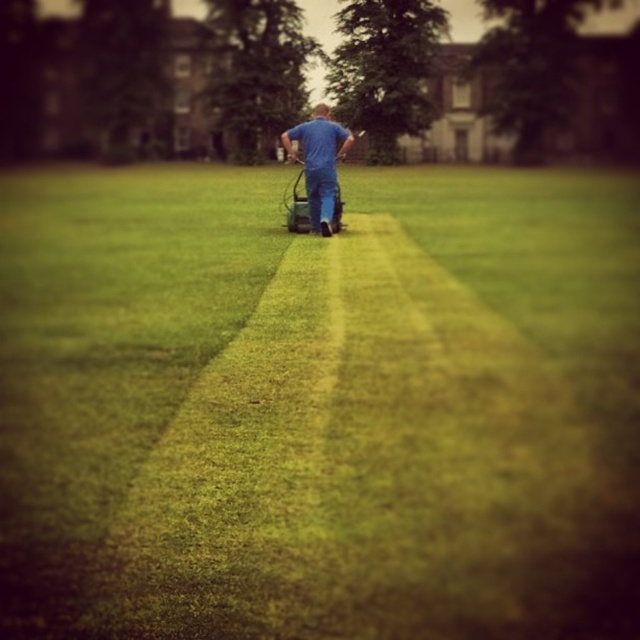
How much distance is there between green grass at center and blue denim jeans at center?

green grass at center and blue denim jeans at center are 4.64 meters apart.

This screenshot has height=640, width=640. I want to click on green grass at center, so click(x=317, y=406).

The width and height of the screenshot is (640, 640). I want to click on green grass at center, so click(x=317, y=406).